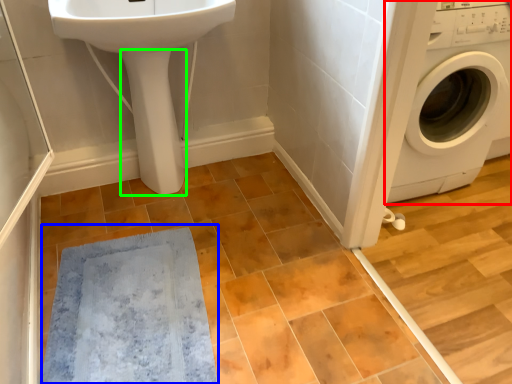
Question: Which is farther away from washing machine (highlighted by a red box)? bath mat (highlighted by a blue box) or bidet (highlighted by a green box)?

Choices:
 (A) bath mat
 (B) bidet

Answer: (A)